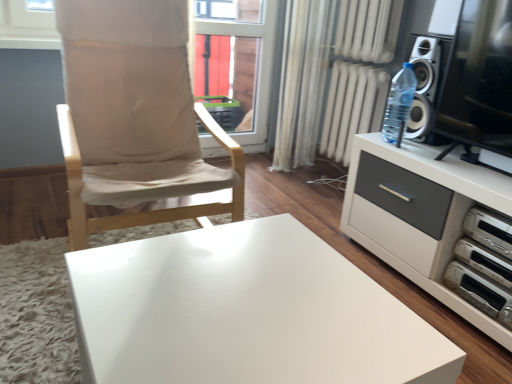
Question: Is white plastic dvd player at lower right, which appears as the first appliance when ordered from the bottom, bigger than white plastic dvd player at right, which is the 1th appliance from top to bottom?

Choices:
 (A) yes
 (B) no

Answer: (B)

Question: From a real-world perspective, does white plastic dvd player at lower right, placed as the 2th appliance when sorted from top to bottom, sit lower than white plastic dvd player at right, which is the 1th appliance from top to bottom?

Choices:
 (A) no
 (B) yes

Answer: (B)

Question: Considering the relative sizes of white plastic dvd player at lower right, placed as the 2th appliance when sorted from top to bottom, and white plastic dvd player at right, which is the 2th appliance in bottom-to-top order, in the image provided, is white plastic dvd player at lower right, placed as the 2th appliance when sorted from top to bottom, thinner than white plastic dvd player at right, which is the 2th appliance in bottom-to-top order,?

Choices:
 (A) no
 (B) yes

Answer: (A)

Question: Is white plastic dvd player at lower right, which appears as the first appliance when ordered from the bottom, facing away from white plastic dvd player at right, which is the 1th appliance from top to bottom?

Choices:
 (A) no
 (B) yes

Answer: (A)

Question: From the image's perspective, is white plastic dvd player at lower right, placed as the 2th appliance when sorted from top to bottom, on white plastic dvd player at right, which is the 2th appliance in bottom-to-top order?

Choices:
 (A) no
 (B) yes

Answer: (A)

Question: Is transparent glass screen door at right in front of or behind beige fabric chair at left in the image?

Choices:
 (A) behind
 (B) front

Answer: (A)

Question: Considering the positions of transparent glass screen door at right and beige fabric chair at left in the image, is transparent glass screen door at right wider or thinner than beige fabric chair at left?

Choices:
 (A) thin
 (B) wide

Answer: (A)

Question: Is transparent glass screen door at right bigger or smaller than beige fabric chair at left?

Choices:
 (A) small
 (B) big

Answer: (A)

Question: From a real-world perspective, relative to beige fabric chair at left, is transparent glass screen door at right vertically above or below?

Choices:
 (A) below
 (B) above

Answer: (B)

Question: Is transparent glass screen door at right spatially inside white sheer curtain at center, or outside of it?

Choices:
 (A) inside
 (B) outside

Answer: (B)

Question: Looking at their shapes, would you say transparent glass screen door at right is wider or thinner than white sheer curtain at center?

Choices:
 (A) wide
 (B) thin

Answer: (A)

Question: From the image's perspective, relative to white sheer curtain at center, is transparent glass screen door at right above or below?

Choices:
 (A) below
 (B) above

Answer: (A)

Question: Relative to white sheer curtain at center, is transparent glass screen door at right in front or behind?

Choices:
 (A) behind
 (B) front

Answer: (B)

Question: From a real-world perspective, relative to transparent glass window at center, is white plastic stereo at lower right vertically above or below?

Choices:
 (A) above
 (B) below

Answer: (B)

Question: Visually, is white plastic stereo at lower right positioned to the left or to the right of transparent glass window at center?

Choices:
 (A) right
 (B) left

Answer: (A)